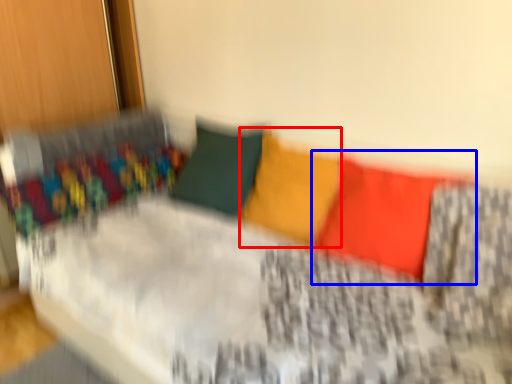
Question: Which object is further to the camera taking this photo, pillow (highlighted by a red box) or pillow (highlighted by a blue box)?

Choices:
 (A) pillow
 (B) pillow

Answer: (A)